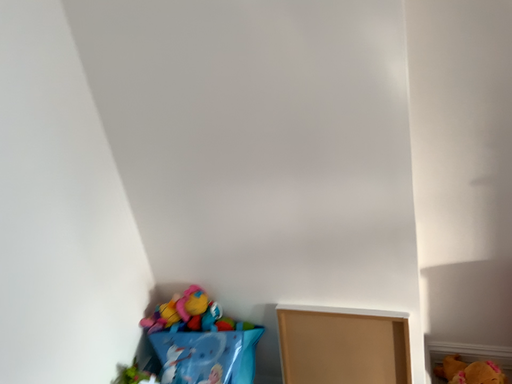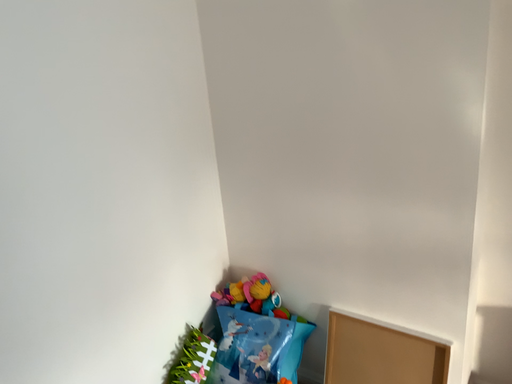
Question: How did the camera likely rotate when shooting the video?

Choices:
 (A) rotated left
 (B) rotated right

Answer: (A)